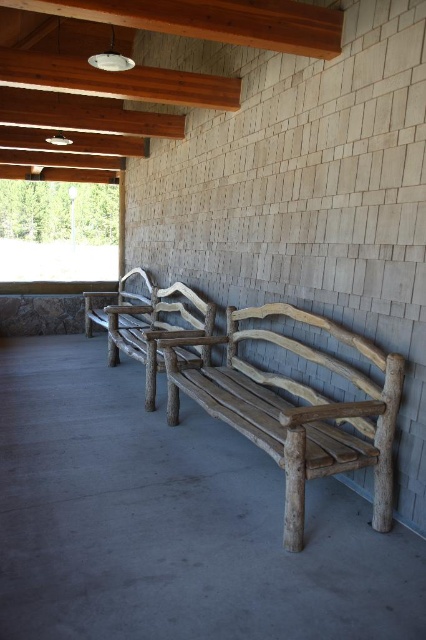
Question: Is natural wood bench at center above rustic wood bench at center?

Choices:
 (A) yes
 (B) no

Answer: (B)

Question: Which point is farther to the camera?

Choices:
 (A) natural wood bench at center
 (B) gray concrete bench at center
 (C) weathered wood bench at center

Answer: (A)

Question: Considering the real-world distances, which object is closest to the natural wood bench at center?

Choices:
 (A) weathered wood bench at center
 (B) rustic wood bench at center
 (C) gray concrete bench at center

Answer: (B)

Question: Which of the following is the farthest from the observer?

Choices:
 (A) tap(115, 337)
 (B) tap(342, 448)
 (C) tap(100, 636)

Answer: (A)

Question: Can you confirm if weathered wood bench at center is bigger than natural wood bench at center?

Choices:
 (A) no
 (B) yes

Answer: (A)

Question: From the image, what is the correct spatial relationship of natural wood bench at center in relation to rustic wood bench at center?

Choices:
 (A) left
 (B) right

Answer: (B)